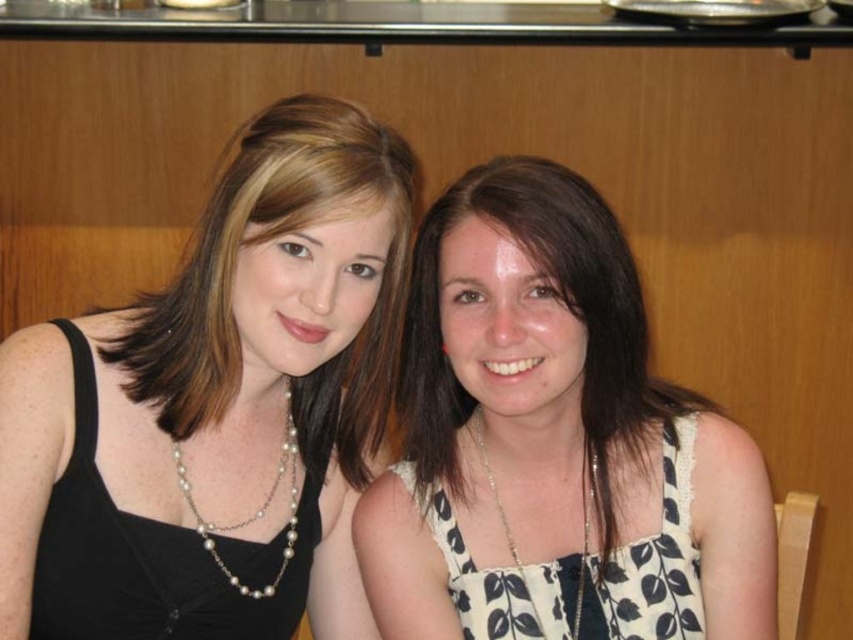
You are a photographer trying to capture a candid shot of both the black satin dress at left and the white printed fabric dress at center. Since you want to ensure both dresses are in the frame, which direction should you position your camera relative to the subjects?

The black satin dress at left is to the left of the white printed fabric dress at center. To capture both in the frame, position your camera to the right side of the subjects so that the camera can encompass both the left and center positions of the dresses.

You are a photographer setting up for a photoshoot. You need to position a light source to the right of both dresses. Since the white dotted dress at center is to the left of white printed fabric dress at center, where should you place the light source relative to the dresses?

The light source should be placed to the right of the white printed fabric dress at center, as the white dotted dress at center is already to the left of it.